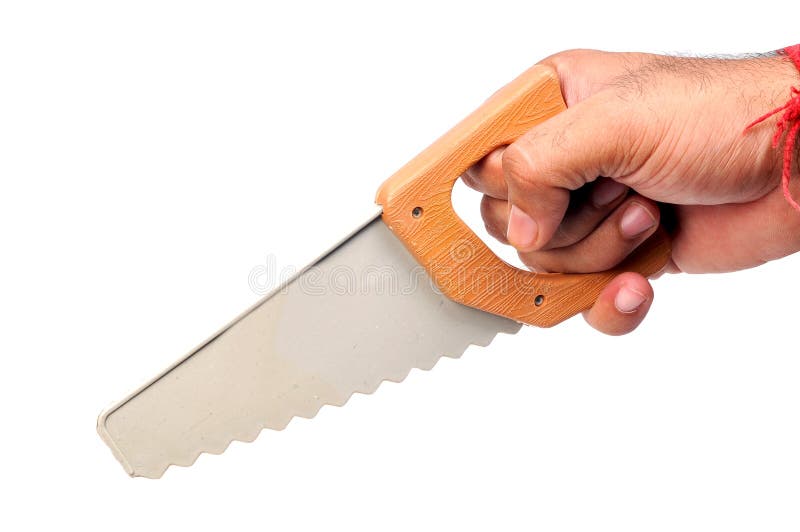
You are a GUI agent. You are given a task and a screenshot of the screen. Output one action in this format:
    pyautogui.click(x=<x>, y=<y>)
    Task: Click on the wood handle
    
    Given the screenshot: What is the action you would take?
    pyautogui.click(x=444, y=224)